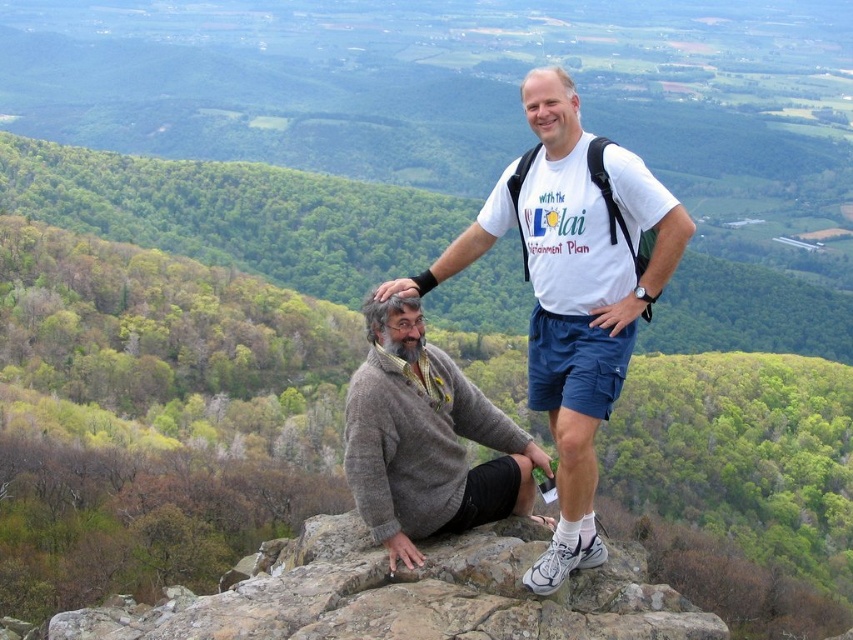
Question: Estimate the real-world distances between objects in this image. Which object is farther from the white t-shirt at center?

Choices:
 (A) knitted sweater at center
 (B) rocky surface at center

Answer: (B)

Question: Can you confirm if white t-shirt at center is bigger than knitted sweater at center?

Choices:
 (A) no
 (B) yes

Answer: (B)

Question: Is rocky surface at center positioned before knitted sweater at center?

Choices:
 (A) no
 (B) yes

Answer: (B)

Question: From the image, what is the correct spatial relationship of white t-shirt at center in relation to rocky surface at center?

Choices:
 (A) left
 (B) right

Answer: (B)

Question: Which point is farther from the camera taking this photo?

Choices:
 (A) (566, 80)
 (B) (354, 406)

Answer: (A)

Question: Which object is closer to the camera taking this photo?

Choices:
 (A) white t-shirt at center
 (B) knitted sweater at center
 (C) rocky surface at center

Answer: (C)